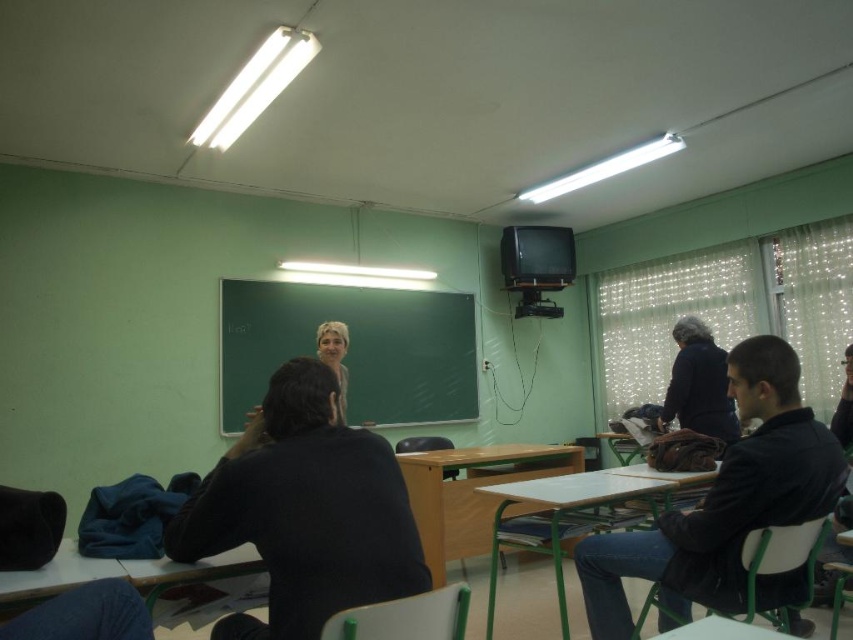
You are a student who needs to reach the white wood table at lower right from your current position near the blonde hair at center. Considering the distance between them, can you comfortably walk there without needing to move around any obstacles?

The white wood table at lower right is 4.22 feet away from the blonde hair at center. Since this distance is within a typical comfortable walking range, you can comfortably walk to the white wood table at lower right without needing to move around obstacles.